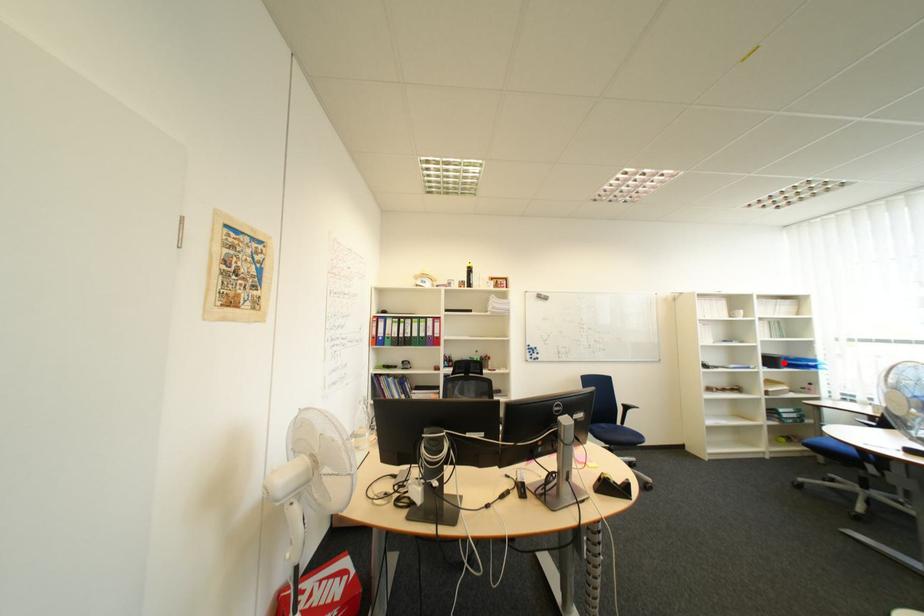
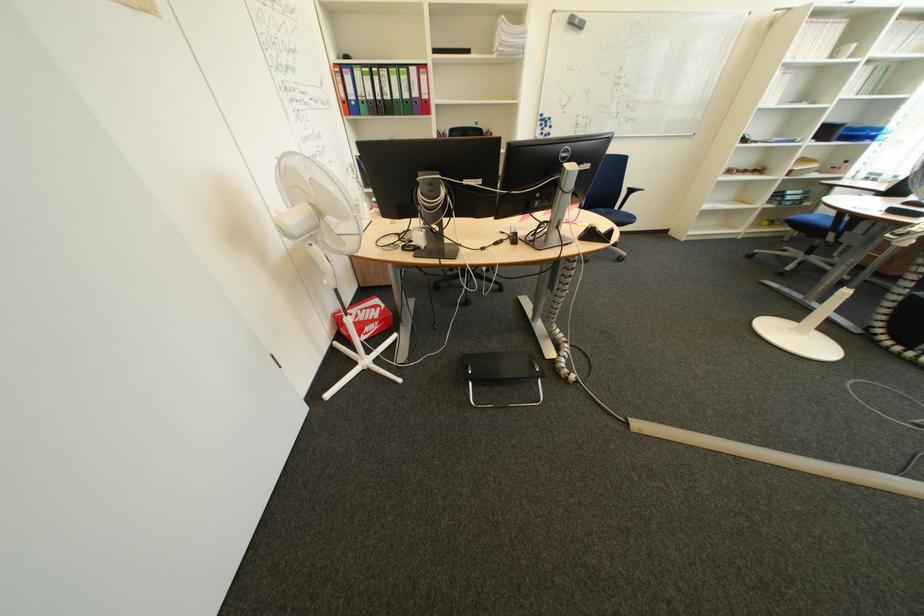
Question: I am providing you with two images of the same scene from different viewpoints. A red point is shown in image1. For the corresponding object point in image2, is it positioned nearer or farther from the camera?

Choices:
 (A) Nearer
 (B) Farther

Answer: (B)